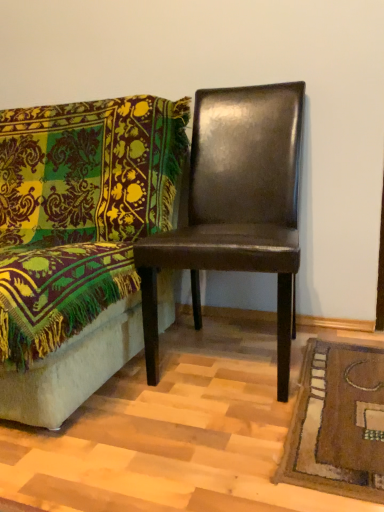
Question: Which direction should I rotate to look at shiny brown leather chair at center, placed as the 1th chair when sorted from right to left?

Choices:
 (A) left
 (B) right

Answer: (B)

Question: Does shiny brown leather chair at right, which is the second chair in right-to-left order, touch shiny brown leather chair at center, placed as the 1th chair when sorted from right to left?

Choices:
 (A) yes
 (B) no

Answer: (B)

Question: From the image's perspective, would you say shiny brown leather chair at right, which is the 1th chair in left-to-right order, is shown under shiny brown leather chair at center, which is the second chair in left-to-right order?

Choices:
 (A) no
 (B) yes

Answer: (B)

Question: Is shiny brown leather chair at right, which is the 1th chair in left-to-right order, looking in the opposite direction of shiny brown leather chair at center, which is the second chair in left-to-right order?

Choices:
 (A) no
 (B) yes

Answer: (A)

Question: Does shiny brown leather chair at right, which is the second chair in right-to-left order, come behind shiny brown leather chair at center, which is the second chair in left-to-right order?

Choices:
 (A) no
 (B) yes

Answer: (A)

Question: Considering the relative sizes of shiny brown leather chair at right, which is the second chair in right-to-left order, and shiny brown leather chair at center, which is the second chair in left-to-right order, in the image provided, is shiny brown leather chair at right, which is the second chair in right-to-left order, smaller than shiny brown leather chair at center, which is the second chair in left-to-right order,?

Choices:
 (A) no
 (B) yes

Answer: (A)

Question: Does shiny brown leather chair at right, which is the second chair in right-to-left order, have a larger size compared to shiny brown leather chair at center, which is the second chair in left-to-right order?

Choices:
 (A) no
 (B) yes

Answer: (B)

Question: Could you tell me if shiny brown leather chair at center, placed as the 1th chair when sorted from right to left, is facing shiny brown leather chair at right, which is the second chair in right-to-left order?

Choices:
 (A) no
 (B) yes

Answer: (A)

Question: Is shiny brown leather chair at center, placed as the 1th chair when sorted from right to left, in front of shiny brown leather chair at right, which is the second chair in right-to-left order?

Choices:
 (A) yes
 (B) no

Answer: (B)

Question: Can you confirm if shiny brown leather chair at center, which is the second chair in left-to-right order, is taller than shiny brown leather chair at right, which is the 1th chair in left-to-right order?

Choices:
 (A) no
 (B) yes

Answer: (B)

Question: From the image's perspective, is shiny brown leather chair at center, placed as the 1th chair when sorted from right to left, above shiny brown leather chair at right, which is the 1th chair in left-to-right order?

Choices:
 (A) yes
 (B) no

Answer: (A)

Question: Are shiny brown leather chair at center, placed as the 1th chair when sorted from right to left, and shiny brown leather chair at right, which is the 1th chair in left-to-right order, located far from each other?

Choices:
 (A) no
 (B) yes

Answer: (A)

Question: Does shiny brown leather chair at center, placed as the 1th chair when sorted from right to left, have a lesser width compared to shiny brown leather chair at right, which is the second chair in right-to-left order?

Choices:
 (A) no
 (B) yes

Answer: (B)

Question: Is shiny brown leather chair at center, placed as the 1th chair when sorted from right to left, bigger or smaller than shiny brown leather chair at right, which is the second chair in right-to-left order?

Choices:
 (A) big
 (B) small

Answer: (B)